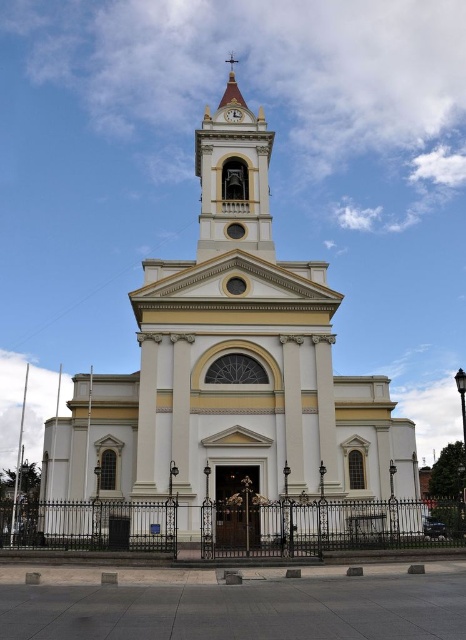
Question: Which object appears farthest from the camera in this image?

Choices:
 (A) white smooth church at center
 (B) smooth cream steeple at center
 (C) white textured clock at center

Answer: (C)

Question: Which point is farther to the camera?

Choices:
 (A) coord(233,112)
 (B) coord(225,154)
 (C) coord(345,474)

Answer: (A)

Question: In this image, where is white smooth church at center located relative to white textured clock at center?

Choices:
 (A) right
 (B) left

Answer: (B)

Question: Which is farther from the smooth cream steeple at center?

Choices:
 (A) white smooth church at center
 (B) white textured clock at center

Answer: (A)

Question: Considering the relative positions of white smooth church at center and white textured clock at center in the image provided, where is white smooth church at center located with respect to white textured clock at center?

Choices:
 (A) left
 (B) right

Answer: (A)

Question: Is white smooth church at center to the right of white textured clock at center from the viewer's perspective?

Choices:
 (A) no
 (B) yes

Answer: (A)